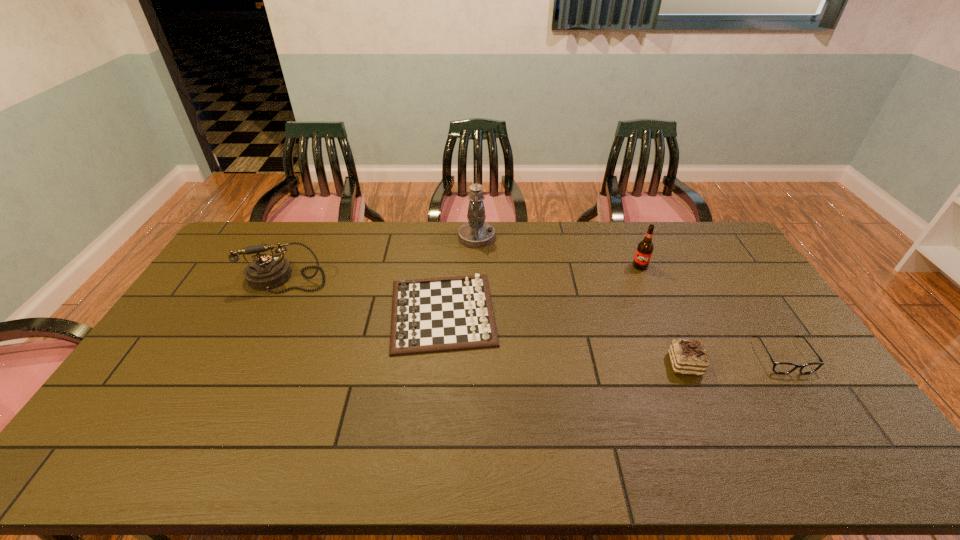
Locate which object is the third closest to the leftmost object. Please provide its 2D coordinates. Your answer should be formatted as a tuple, i.e. [(x, y)], where the tuple contains the x and y coordinates of a point satisfying the conditions above.

[(644, 251)]

The height and width of the screenshot is (540, 960). Find the location of `object that is the fourth closest to the chessboard`. object that is the fourth closest to the chessboard is located at coordinates (644, 251).

You are a GUI agent. You are given a task and a screenshot of the screen. Output one action in this format:
    pyautogui.click(x=<x>, y=<y>)
    Task: Click on the free spot that satisfies the following two spatial constraints: 1. on the front side of the chocolate cake; 2. on the right side of the root beer
    
    Given the screenshot: What is the action you would take?
    pyautogui.click(x=683, y=364)

Identify the location of vacant space that satisfies the following two spatial constraints: 1. on the front side of the tallest object; 2. on the right side of the root beer. Image resolution: width=960 pixels, height=540 pixels. (476, 266).